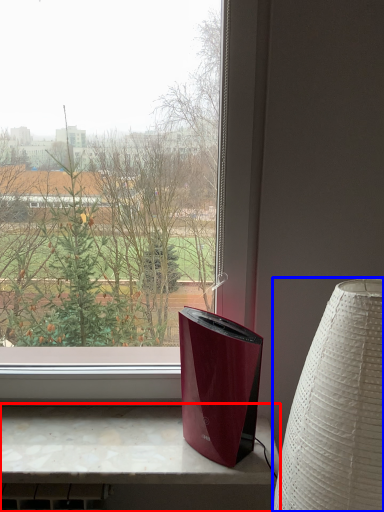
Question: Which of the following is the closest to the observer, computer desk (highlighted by a red box) or lamp (highlighted by a blue box)?

Choices:
 (A) computer desk
 (B) lamp

Answer: (B)